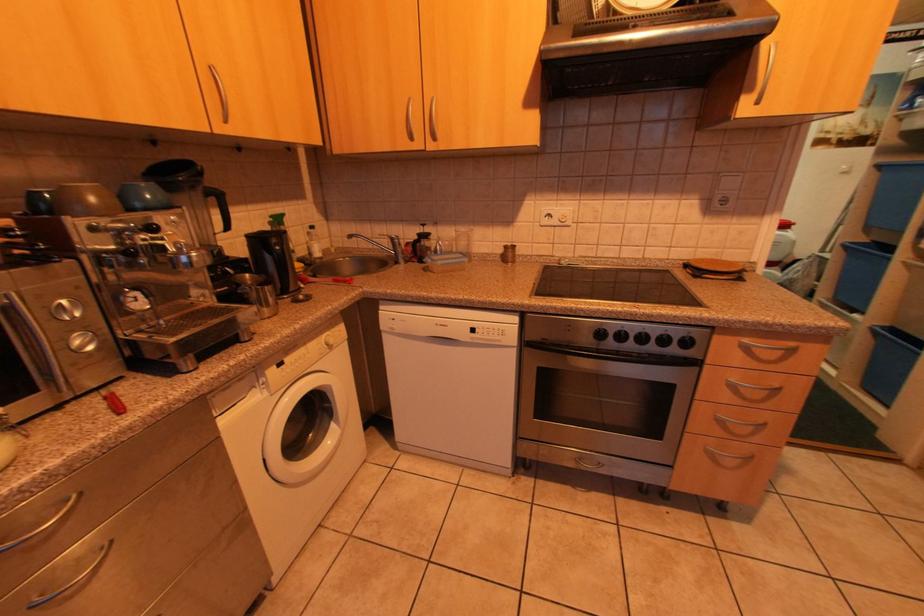
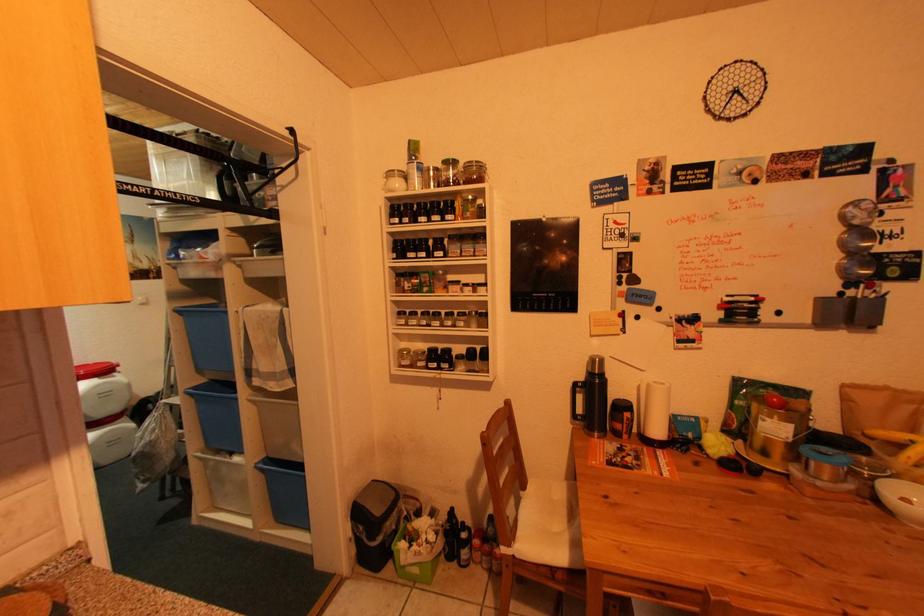
Question: The camera is either moving clockwise (left) or counter-clockwise (right) around the object. The first image is from the beginning of the video and the second image is from the end. Is the camera moving left or right when shooting the video?

Choices:
 (A) Left
 (B) Right

Answer: (A)